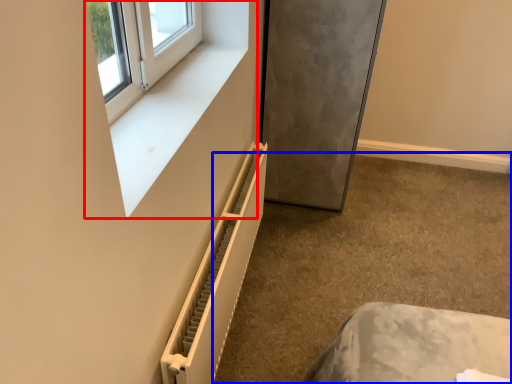
Question: Among these objects, which one is nearest to the camera, window frame (highlighted by a red box) or concrete (highlighted by a blue box)?

Choices:
 (A) window frame
 (B) concrete

Answer: (A)